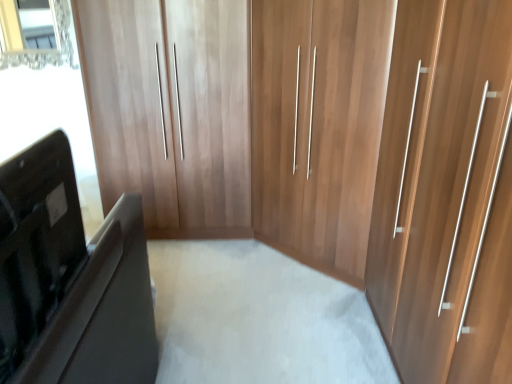
I want to click on clear glass mirror at upper left, so tap(35, 33).

The width and height of the screenshot is (512, 384). Describe the element at coordinates (35, 33) in the screenshot. I see `clear glass mirror at upper left` at that location.

This screenshot has width=512, height=384. What do you see at coordinates (70, 279) in the screenshot?
I see `matte black laptop at left` at bounding box center [70, 279].

Find the location of a particular element. This screenshot has height=384, width=512. matte black laptop at left is located at coordinates click(x=70, y=279).

Identify the location of clear glass mirror at upper left. This screenshot has width=512, height=384. (35, 33).

Which is more to the left, clear glass mirror at upper left or matte black laptop at left?

clear glass mirror at upper left.

Which object is further away from the camera taking this photo, clear glass mirror at upper left or matte black laptop at left?

Positioned behind is clear glass mirror at upper left.

Is point (58, 14) positioned behind point (31, 328)?

Yes, it is behind point (31, 328).

From the image's perspective, is clear glass mirror at upper left located beneath matte black laptop at left?

Incorrect, from the image's perspective, clear glass mirror at upper left is higher than matte black laptop at left.

From a real-world perspective, does clear glass mirror at upper left sit lower than matte black laptop at left?

Actually, clear glass mirror at upper left is physically above matte black laptop at left in the real world.

Is clear glass mirror at upper left wider or thinner than matte black laptop at left?

In the image, clear glass mirror at upper left appears to be more narrow than matte black laptop at left.

Considering the sizes of clear glass mirror at upper left and matte black laptop at left in the image, is clear glass mirror at upper left taller or shorter than matte black laptop at left?

clear glass mirror at upper left is taller than matte black laptop at left.

Who is smaller, clear glass mirror at upper left or matte black laptop at left?

Smaller between the two is clear glass mirror at upper left.

Would you say clear glass mirror at upper left is inside or outside matte black laptop at left?

The correct answer is: outside.

Can you see clear glass mirror at upper left touching matte black laptop at left?

No, clear glass mirror at upper left is not in contact with matte black laptop at left.

From the picture: Is clear glass mirror at upper left oriented away from matte black laptop at left?

No, clear glass mirror at upper left's orientation is not away from matte black laptop at left.

How distant is clear glass mirror at upper left from matte black laptop at left?

clear glass mirror at upper left is 7.55 feet away from matte black laptop at left.

Find the location of a particular element. Image resolution: width=512 pixels, height=384 pixels. furniture below the clear glass mirror at upper left (from the image's perspective) is located at coordinates (70, 279).

Is matte black laptop at left at the left side of clear glass mirror at upper left?

No, matte black laptop at left is not to the left of clear glass mirror at upper left.

Which object is further away from the camera taking this photo, matte black laptop at left or clear glass mirror at upper left?

Positioned behind is clear glass mirror at upper left.

In the scene shown: Which is closer to the camera, (25,360) or (61,36)?

The point (25,360) is closer to the camera.

From the image's perspective, who appears lower, matte black laptop at left or clear glass mirror at upper left?

matte black laptop at left, from the image's perspective.

From a real-world perspective, is matte black laptop at left positioned above or below clear glass mirror at upper left?

matte black laptop at left is situated lower than clear glass mirror at upper left in the real world.

From the picture: Which object is thinner, matte black laptop at left or clear glass mirror at upper left?

clear glass mirror at upper left.

Can you confirm if matte black laptop at left is shorter than clear glass mirror at upper left?

Yes.

Is matte black laptop at left smaller than clear glass mirror at upper left?

No, matte black laptop at left is not smaller than clear glass mirror at upper left.

Is clear glass mirror at upper left completely or partially inside matte black laptop at left?

No.

From the picture: Are matte black laptop at left and clear glass mirror at upper left far apart?

matte black laptop at left is far away from clear glass mirror at upper left.

Is matte black laptop at left facing towards clear glass mirror at upper left?

No, matte black laptop at left is not oriented towards clear glass mirror at upper left.

What's the angular difference between matte black laptop at left and clear glass mirror at upper left's facing directions?

89.4 degrees.

This screenshot has height=384, width=512. Find the location of `mirror above the matte black laptop at left (from a real-world perspective)`. mirror above the matte black laptop at left (from a real-world perspective) is located at coordinates (35, 33).

At what (x,y) coordinates should I click in order to perform the action: click on mirror above the matte black laptop at left (from the image's perspective). Please return your answer as a coordinate pair (x, y). The image size is (512, 384). Looking at the image, I should click on (35, 33).

Locate an element on the screen. The width and height of the screenshot is (512, 384). furniture located underneath the clear glass mirror at upper left (from a real-world perspective) is located at coordinates (70, 279).